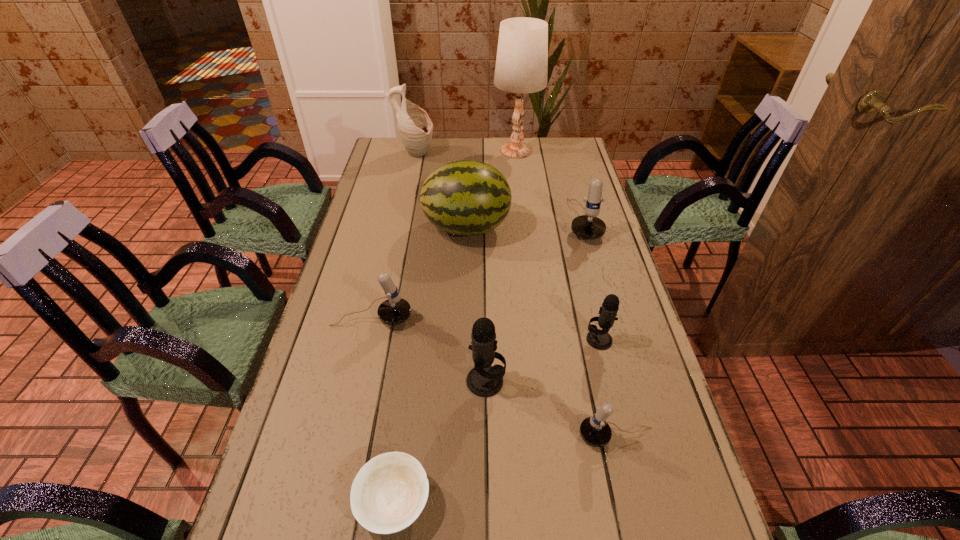
Locate an element on the screen. This screenshot has width=960, height=540. the tallest object is located at coordinates (521, 67).

You are a GUI agent. You are given a task and a screenshot of the screen. Output one action in this format:
    pyautogui.click(x=<x>, y=<y>)
    Task: Click on the second tallest object
    
    Given the screenshot: What is the action you would take?
    pyautogui.click(x=415, y=128)

The width and height of the screenshot is (960, 540). What are the coordinates of `watermelon` in the screenshot? It's located at (466, 198).

Image resolution: width=960 pixels, height=540 pixels. Find the location of `the nearer black microphone`. the nearer black microphone is located at coordinates (484, 380).

Locate an element on the screen. This screenshot has height=540, width=960. the fourth microphone from right to left is located at coordinates (x=484, y=380).

Image resolution: width=960 pixels, height=540 pixels. I want to click on the farthest white microphone, so click(589, 226).

Where is `the farthest microphone`? the farthest microphone is located at coordinates pyautogui.click(x=589, y=226).

Find the location of a particular element. Image resolution: width=960 pixels, height=540 pixels. the leftmost white microphone is located at coordinates (395, 310).

Find the location of a particular element. the second nearest white microphone is located at coordinates (395, 310).

Where is `the smaller black microphone`? the smaller black microphone is located at coordinates (599, 339).